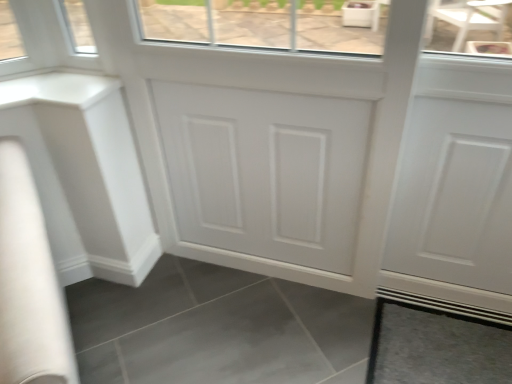
Question: Considering the positions of point (86, 100) and point (382, 311), is point (86, 100) closer or farther from the camera than point (382, 311)?

Choices:
 (A) farther
 (B) closer

Answer: (B)

Question: From a real-world perspective, is white matte counter top at left positioned above or below gray matte tile at lower right?

Choices:
 (A) below
 (B) above

Answer: (B)

Question: Is white matte counter top at left wider or thinner than gray matte tile at lower right?

Choices:
 (A) wide
 (B) thin

Answer: (B)

Question: In the image, is gray matte tile at lower right positioned in front of or behind white matte counter top at left?

Choices:
 (A) behind
 (B) front

Answer: (A)

Question: Would you say gray matte tile at lower right is to the left or to the right of white matte counter top at left in the picture?

Choices:
 (A) right
 (B) left

Answer: (A)

Question: From the image's perspective, relative to white matte counter top at left, is gray matte tile at lower right above or below?

Choices:
 (A) below
 (B) above

Answer: (A)

Question: Considering the positions of gray matte tile at lower right and white matte counter top at left in the image, is gray matte tile at lower right taller or shorter than white matte counter top at left?

Choices:
 (A) short
 (B) tall

Answer: (A)